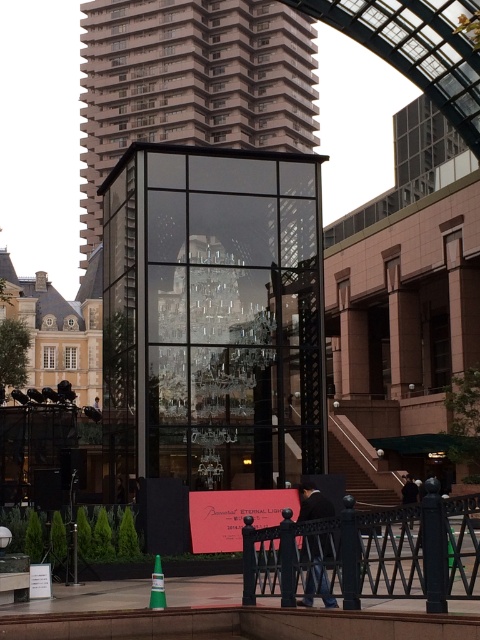
Who is positioned more to the left, black metal fence at lower center or matte red sign at center?

matte red sign at center is more to the left.

Which is above, black metal fence at lower center or matte red sign at center?

black metal fence at lower center is above.

Does point (247, 518) lie in front of point (205, 544)?

Yes, point (247, 518) is in front of point (205, 544).

At what (x,y) coordinates should I click in order to perform the action: click on black metal fence at lower center. Please return your answer as a coordinate pair (x, y). Looking at the image, I should click on (369, 554).

Can you confirm if transparent glass tower at center is wider than green plastic cone at lower center?

Yes, transparent glass tower at center is wider than green plastic cone at lower center.

Is transparent glass tower at center closer to camera compared to green plastic cone at lower center?

No.

Between point (227, 90) and point (159, 584), which one is positioned behind?

The point (227, 90) is behind.

Find the location of a particular element. The image size is (480, 640). transparent glass tower at center is located at coordinates (191, 83).

Is matte red sign at center closer to camera compared to green plastic cone at lower center?

No, matte red sign at center is behind green plastic cone at lower center.

Describe the element at coordinates (235, 515) in the screenshot. The image size is (480, 640). I see `matte red sign at center` at that location.

The width and height of the screenshot is (480, 640). In order to click on matte red sign at center in this screenshot , I will do `click(235, 515)`.